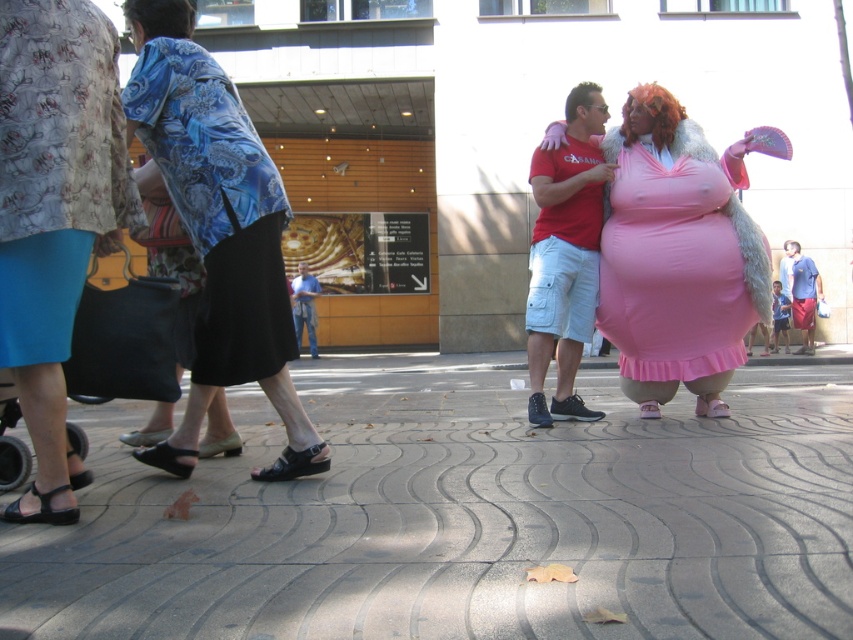
Which is behind, point (36, 628) or point (642, 164)?

The point (642, 164) is more distant.

Is smooth concrete pavement at center below pink satin dress at center?

Correct, smooth concrete pavement at center is located below pink satin dress at center.

Where is `smooth concrete pavement at center`? This screenshot has width=853, height=640. smooth concrete pavement at center is located at coordinates (465, 516).

Locate an element on the screen. smooth concrete pavement at center is located at coordinates (465, 516).

Looking at this image, is matte red t-shirt at center smaller than fluffy pink wig at center?

No.

Identify the location of matte red t-shirt at center. The width and height of the screenshot is (853, 640). (564, 260).

Does point (747, 582) come in front of point (172, 3)?

Yes, point (747, 582) is closer to viewer.

Does point (468, 627) come behind point (172, 35)?

No.

This screenshot has height=640, width=853. Find the location of `smooth concrete pavement at center`. smooth concrete pavement at center is located at coordinates (465, 516).